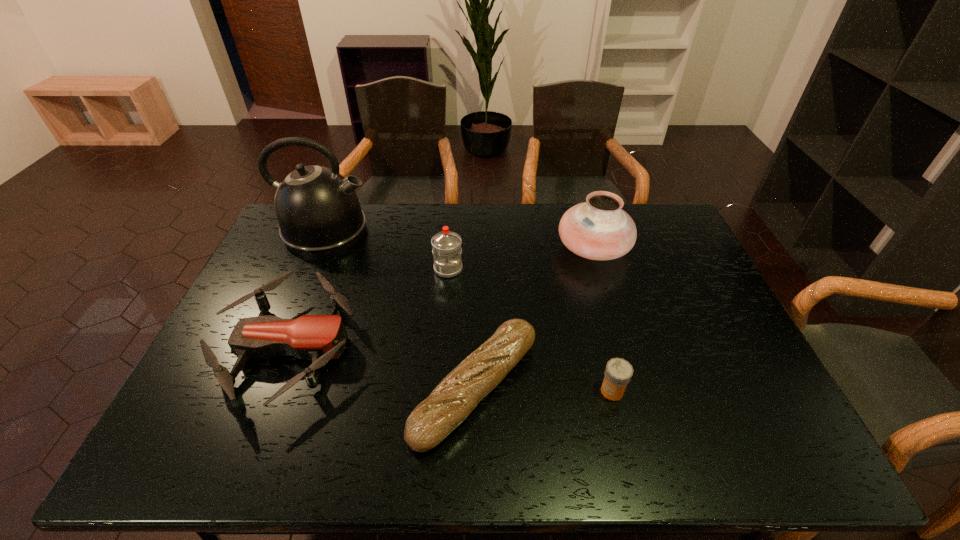
Locate an element on the screen. The image size is (960, 540). free space between the water bottle and the drone is located at coordinates (368, 308).

Where is `vacant space in between the baguet and the fourth shortest object`? This screenshot has height=540, width=960. vacant space in between the baguet and the fourth shortest object is located at coordinates (462, 328).

At what (x,y) coordinates should I click in order to perform the action: click on vacant space that is in between the baguet and the pottery. Please return your answer as a coordinate pair (x, y). Looking at the image, I should click on (535, 318).

The width and height of the screenshot is (960, 540). In order to click on vacant space that's between the medicine and the baguet in this screenshot , I will do `click(543, 389)`.

In order to click on the fifth closest object relative to the kettle in this screenshot , I will do tap(618, 372).

Image resolution: width=960 pixels, height=540 pixels. Find the location of `object that stands as the second closest to the baguet`. object that stands as the second closest to the baguet is located at coordinates (318, 337).

At what (x,y) coordinates should I click in order to perform the action: click on blank space that satisfies the following two spatial constraints: 1. on the spout of the baguet; 2. on the right side of the kettle. Please return your answer as a coordinate pair (x, y). Image resolution: width=960 pixels, height=540 pixels. Looking at the image, I should click on (257, 388).

The width and height of the screenshot is (960, 540). I want to click on free point that satisfies the following two spatial constraints: 1. on the handle side of the third tallest object; 2. on the right side of the baguet, so coord(439,388).

You are a GUI agent. You are given a task and a screenshot of the screen. Output one action in this format:
    pyautogui.click(x=<x>, y=<y>)
    Task: Click on the free space that satisfies the following two spatial constraints: 1. on the handle side of the third tallest object; 2. on the front-facing side of the drone
    
    Given the screenshot: What is the action you would take?
    pyautogui.click(x=442, y=348)